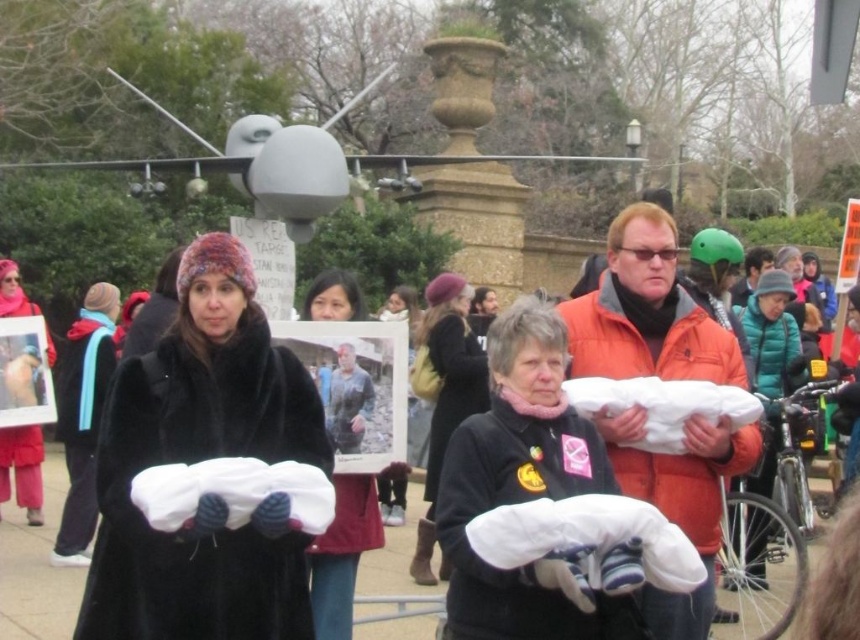
You are a photographer at the event and want to capture a photo of the black fur coat at center and the white cotton shirt at center. Which one is positioned higher in the image?

The black fur coat at center is above the white cotton shirt at center in the image.

You are a photographer at the event and want to capture both the black wool coat at center and the velvet red coat at center in a single frame. Which coat should you focus on first to ensure both are in the shot?

The black wool coat at center is located above the velvet red coat at center, so focusing on the higher position of the black wool coat at center first will help ensure both coats are captured in the frame.